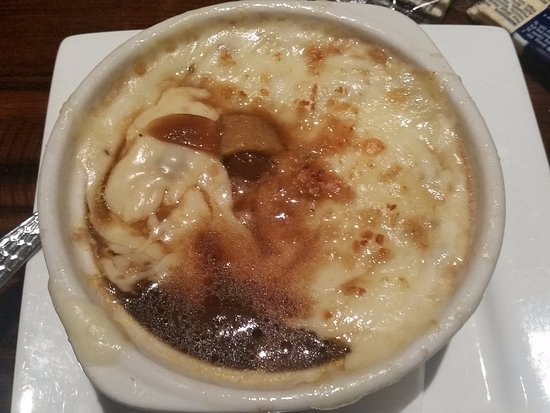
You are a GUI agent. You are given a task and a screenshot of the screen. Output one action in this format:
    pyautogui.click(x=<x>, y=<y>)
    Task: Click on the white bowl
    The width and height of the screenshot is (550, 413).
    Given the screenshot: What is the action you would take?
    pyautogui.click(x=472, y=296)